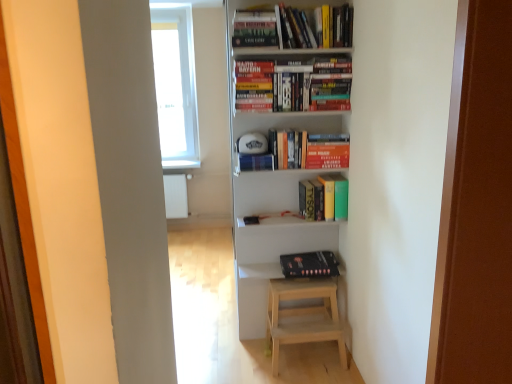
Question: Is hardcover books at upper center, the 4th book from the bottom, further to camera compared to hardcover book at upper center?

Choices:
 (A) yes
 (B) no

Answer: (B)

Question: Does hardcover books at upper center, which is counted as the first book, starting from the top, appear on the left side of hardcover book at upper center?

Choices:
 (A) yes
 (B) no

Answer: (A)

Question: Can you confirm if hardcover books at upper center, which is counted as the first book, starting from the top, is thinner than hardcover book at upper center?

Choices:
 (A) yes
 (B) no

Answer: (B)

Question: Is hardcover books at upper center, the 4th book from the bottom, facing away from hardcover book at upper center?

Choices:
 (A) no
 (B) yes

Answer: (A)

Question: Is hardcover books at upper center, the 4th book from the bottom, located outside hardcover book at upper center?

Choices:
 (A) yes
 (B) no

Answer: (A)

Question: Is hardcover book at center, positioned as the third book in top-to-bottom order, wider or thinner than hardcover books at upper center, marked as the 2th book in a top-to-bottom arrangement?

Choices:
 (A) wide
 (B) thin

Answer: (A)

Question: From their relative heights in the image, would you say hardcover book at center, positioned as the third book in top-to-bottom order, is taller or shorter than hardcover books at upper center, which is the 3th book from bottom to top?

Choices:
 (A) tall
 (B) short

Answer: (B)

Question: From the image's perspective, is hardcover book at center, positioned as the third book in top-to-bottom order, above or below hardcover books at upper center, which is the 3th book from bottom to top?

Choices:
 (A) above
 (B) below

Answer: (B)

Question: Based on their sizes in the image, would you say hardcover book at center, marked as the second book in a bottom-to-top arrangement, is bigger or smaller than hardcover books at upper center, which is the 3th book from bottom to top?

Choices:
 (A) big
 (B) small

Answer: (B)

Question: In terms of height, does hardcover books at upper center, which is counted as the first book, starting from the top, look taller or shorter compared to hardcover books at upper center, marked as the 2th book in a top-to-bottom arrangement?

Choices:
 (A) short
 (B) tall

Answer: (A)

Question: Choose the correct answer: Is hardcover books at upper center, the 4th book from the bottom, inside hardcover books at upper center, marked as the 2th book in a top-to-bottom arrangement, or outside it?

Choices:
 (A) inside
 (B) outside

Answer: (B)

Question: Looking at their shapes, would you say hardcover books at upper center, the 4th book from the bottom, is wider or thinner than hardcover books at upper center, marked as the 2th book in a top-to-bottom arrangement?

Choices:
 (A) wide
 (B) thin

Answer: (A)

Question: Considering the positions of point (344, 29) and point (266, 66), is point (344, 29) closer or farther from the camera than point (266, 66)?

Choices:
 (A) closer
 (B) farther

Answer: (A)

Question: Is hardcover books at upper center, which is counted as the first book, starting from the top, situated inside transparent plastic window sill at upper center or outside?

Choices:
 (A) outside
 (B) inside

Answer: (A)

Question: From the image's perspective, is hardcover books at upper center, the 4th book from the bottom, located above or below transparent plastic window sill at upper center?

Choices:
 (A) below
 (B) above

Answer: (B)